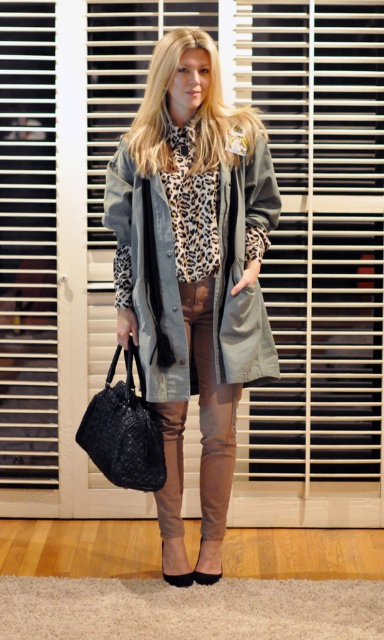
You are a fashion designer trying to create a new outfit. You see the matte olive green trench coat at center and the leopard print fabric scarf at center in the image. Which item is wider?

The matte olive green trench coat at center is wider than the leopard print fabric scarf at center.

You are a photographer setting up a shoot in the described scene. You want to ensure that the black woven handbag at lower left and the leopard print fabric scarf at center are both visible in the final photo. Based on their positions, which object should you adjust to avoid being blocked by the other?

The leopard print fabric scarf at center is behind the black woven handbag at lower left. To ensure both are visible, you should move the leopard print fabric scarf at center forward so it is no longer blocked by the handbag.

You are designing a virtual fitting room and need to position the matte olive green trench coat at center correctly. Based on the scene description, what are the coordinates where the coat should be placed?

The matte olive green trench coat at center should be placed at coordinates point [241,272] as specified in the description.